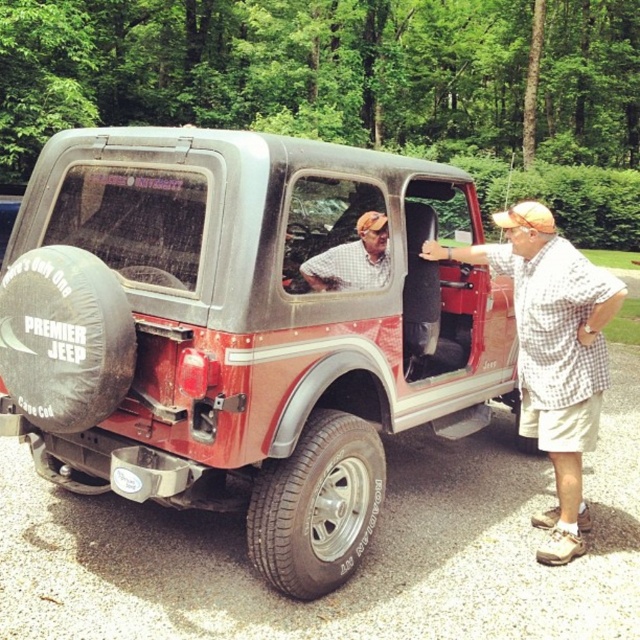
You are standing at the center of the image. Which direction should you move to get closer to the checkered fabric shirt at right located at point (552, 353)?

The checkered fabric shirt at right is located at point (552, 353). Since the point is at 0.553 on the x axis and 0.864 on the y axis, you should move to the right and upwards to get closer to it.

You are a passenger trying to get into the Jeep. There are two points marked in the image. The first point is at coordinate point(358, 492) and the second point is at coordinate point(385, 243). Which point should you approach to enter the Jeep safely?

Point(358, 492) is in front of point(385, 243), so you should approach point(358, 492) to enter the Jeep safely.

You are a photographer trying to capture the two points in the image. Which point, point (556, 292) or point (340, 275), is closer to your camera lens?

Point (556, 292) is further to the viewer than point (340, 275), so the point closer to the camera lens is point (340, 275).